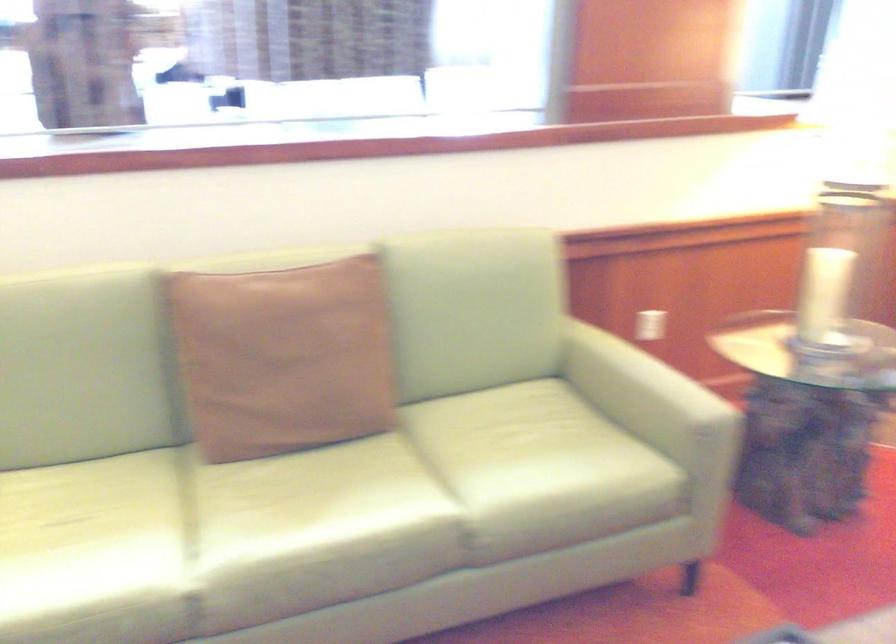
The width and height of the screenshot is (896, 644). In order to click on sofa armrest in this screenshot , I will do `click(640, 386)`.